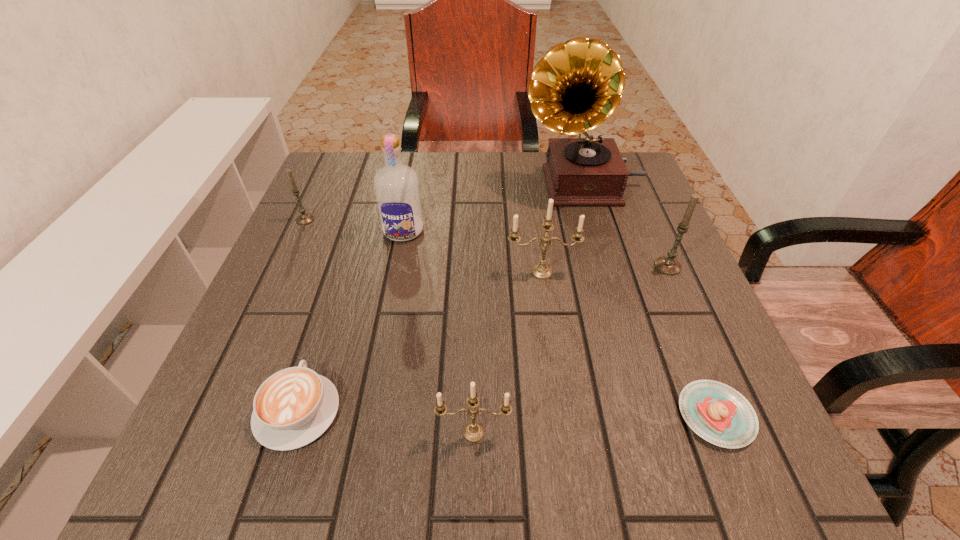
In the image, there is a desktop. Identify the location of free space at the near edge. (592, 438).

This screenshot has height=540, width=960. In the image, there is a desktop. What are the coordinates of `vacant space at the left edge` in the screenshot? It's located at 327,205.

The height and width of the screenshot is (540, 960). In the image, there is a desktop. What are the coordinates of `vacant space at the far left corner` in the screenshot? It's located at (359, 202).

I want to click on vacant space at the near left corner of the desktop, so click(178, 475).

The image size is (960, 540). Find the location of `vacant area at the far right corner`. vacant area at the far right corner is located at coordinates (632, 155).

In the image, there is a desktop. What are the coordinates of `blank space at the near right corner` in the screenshot? It's located at (746, 488).

This screenshot has width=960, height=540. I want to click on empty space that is in between the brown phonograph record and the farther metallic candle, so click(562, 228).

Image resolution: width=960 pixels, height=540 pixels. In order to click on empty space that is in between the second candle from left to right and the right metallic candle in this screenshot , I will do `click(508, 352)`.

Image resolution: width=960 pixels, height=540 pixels. I want to click on unoccupied position between the bigger metallic candle and the leftmost object, so click(x=423, y=246).

Locate an element on the screen. The height and width of the screenshot is (540, 960). vacant space that's between the nearest candle and the seventh tallest object is located at coordinates (386, 421).